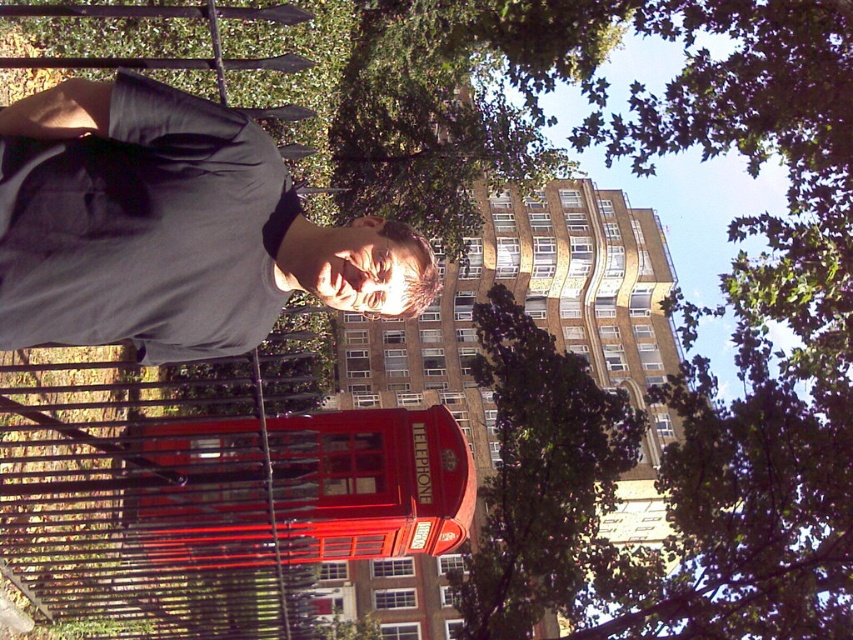
You are standing at the point labeled point (152, 81) and want to walk to the point labeled point (595, 520). Which direction should you move relative to the person in the image?

You should move towards the back of the person in the image because point (152, 81) is in front of point (595, 520).